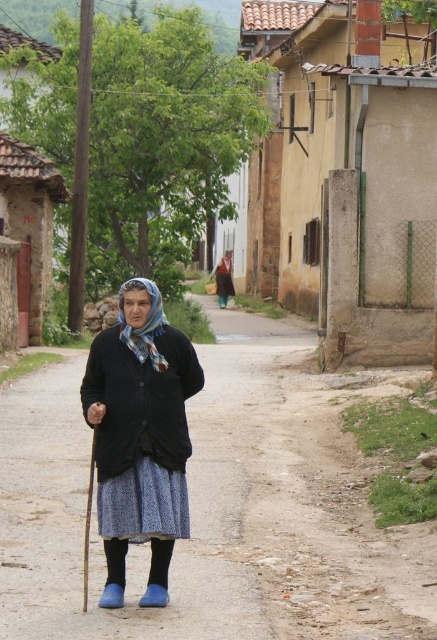
You are standing at the camera position and want to walk towards the dirt road at center. In which direction should you move relative to the woman?

The dirt road at center is located at point coordinates, so you should move forward towards the center of the scene where the dirt road is located.